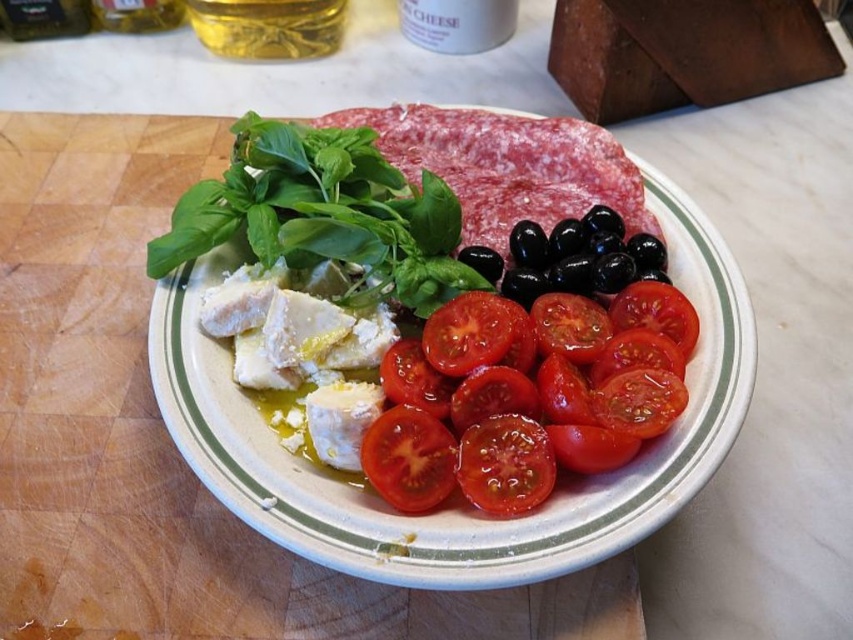
What do you see at coordinates (531, 396) in the screenshot?
I see `red glossy tomatoes at center` at bounding box center [531, 396].

I want to click on red glossy tomatoes at center, so click(x=531, y=396).

Can you confirm if green leafy basil at upper left is positioned below semi-dry cured meat at upper center?

Yes.

Is point (416, 243) farther from camera compared to point (515, 136)?

That is False.

Locate an element on the screen. This screenshot has height=640, width=853. green leafy basil at upper left is located at coordinates click(325, 214).

Can you confirm if golden liquid at top is positioned above bright red tomato at lower center?

Yes, golden liquid at top is above bright red tomato at lower center.

This screenshot has height=640, width=853. Identify the location of golden liquid at top. (268, 26).